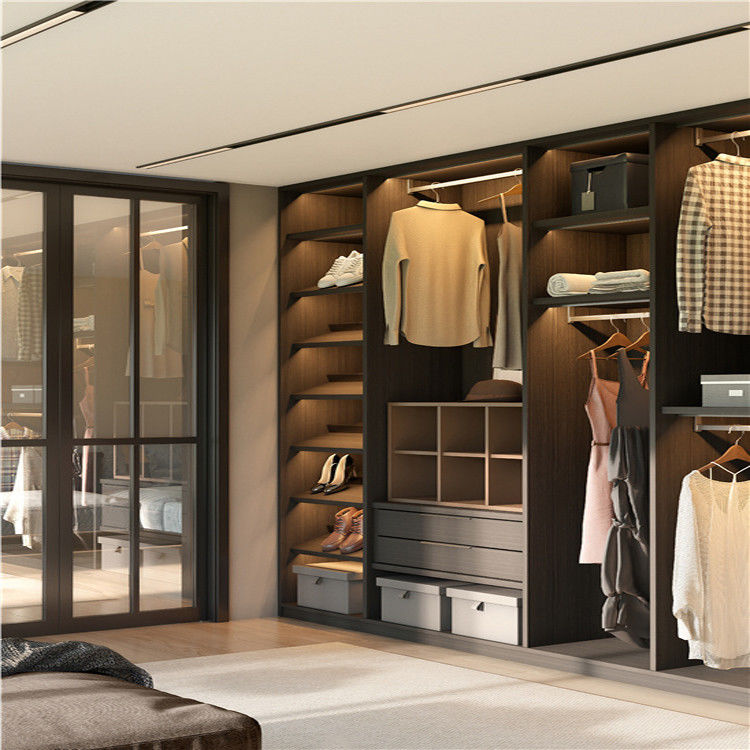
The height and width of the screenshot is (750, 750). What are the coordinates of `large modern designer closet` in the screenshot? It's located at (652, 211).